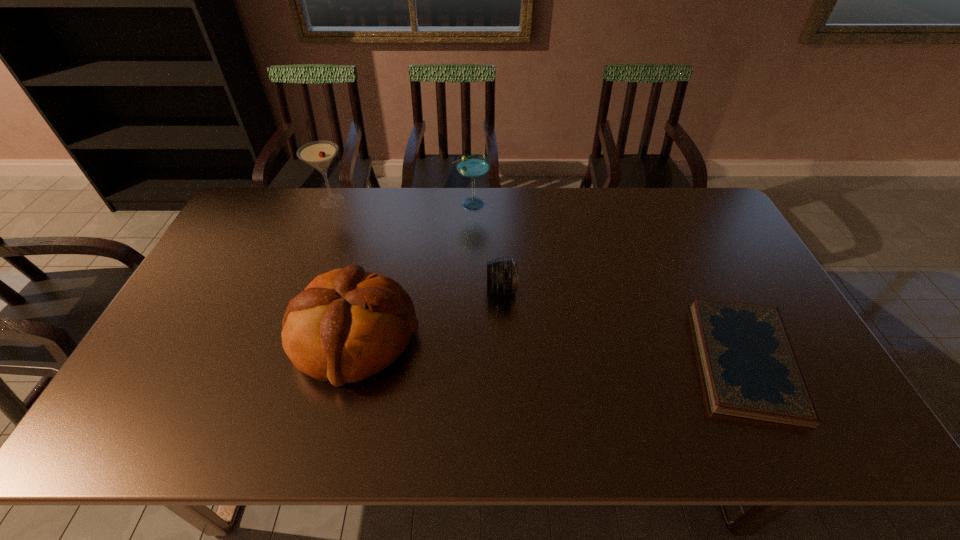
At what (x,y) coordinates should I click in order to perform the action: click on vacant region located 0.260m at the front element of the fourth tallest object. Please return your answer as a coordinate pair (x, y). The image size is (960, 540). Looking at the image, I should click on (399, 289).

In order to click on vacant space located 0.400m at the front element of the fourth tallest object in this screenshot , I will do tap(351, 289).

Locate an element on the screen. The width and height of the screenshot is (960, 540). vacant space located at the front element of the fourth tallest object is located at coordinates (429, 289).

You are a GUI agent. You are given a task and a screenshot of the screen. Output one action in this format:
    pyautogui.click(x=<x>, y=<y>)
    Task: Click on the blank space located 0.400m on the back of the rightmost object
    
    Given the screenshot: What is the action you would take?
    pyautogui.click(x=675, y=217)

Identify the location of object that is at the near edge. The width and height of the screenshot is (960, 540). (750, 368).

Locate an element on the screen. The width and height of the screenshot is (960, 540). object that is at the right edge is located at coordinates (750, 368).

This screenshot has width=960, height=540. I want to click on object that is at the near right corner, so click(x=750, y=368).

Locate an element on the screen. vacant space at the far edge of the desktop is located at coordinates (565, 202).

In the image, there is a desktop. Identify the location of vacant space at the near edge. The height and width of the screenshot is (540, 960). (259, 438).

Locate an element on the screen. vacant space at the left edge is located at coordinates (155, 352).